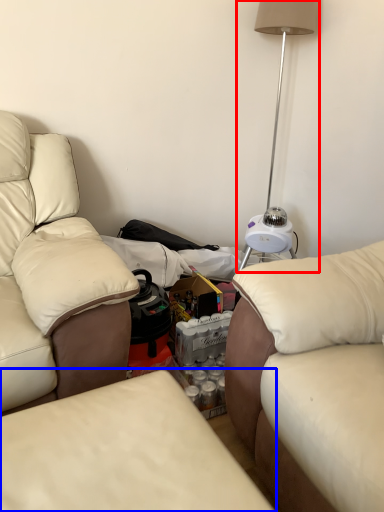
Question: Which object is further to the camera taking this photo, table lamp (highlighted by a red box) or studio couch (highlighted by a blue box)?

Choices:
 (A) table lamp
 (B) studio couch

Answer: (A)